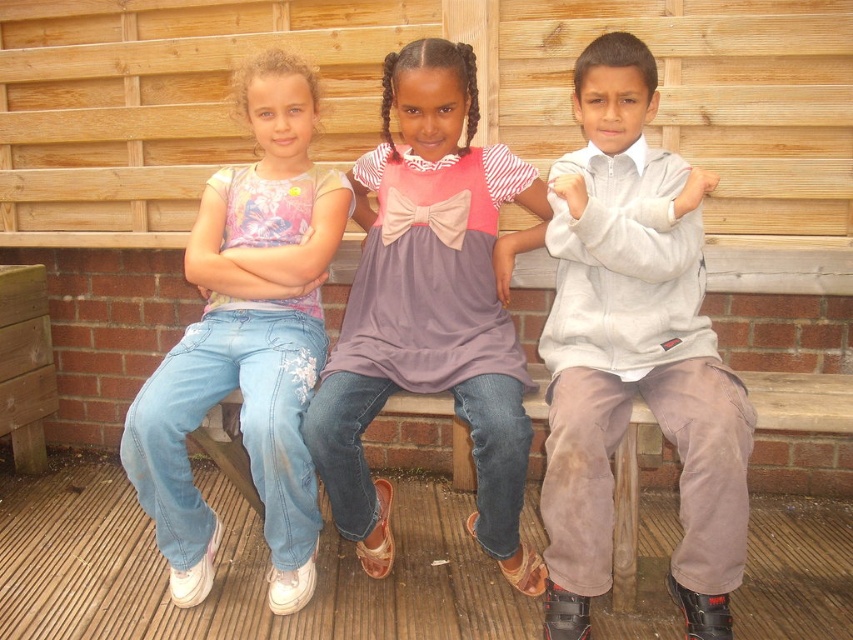
Can you confirm if light gray fleece jacket at center is wider than pink satin dress at center?

Incorrect, light gray fleece jacket at center's width does not surpass pink satin dress at center's.

Which is in front, point (631, 147) or point (483, 476)?

Point (483, 476) is in front.

Does point (606, 216) come in front of point (461, 84)?

Yes, point (606, 216) is closer to viewer.

This screenshot has width=853, height=640. Identify the location of light gray fleece jacket at center. (634, 353).

Who is positioned more to the left, pink satin dress at center or light blue denim jeans at left?

Positioned to the left is light blue denim jeans at left.

Does pink satin dress at center appear on the right side of light blue denim jeans at left?

Yes, pink satin dress at center is to the right of light blue denim jeans at left.

Locate an element on the screen. Image resolution: width=853 pixels, height=640 pixels. pink satin dress at center is located at coordinates (431, 307).

Is light gray fleece jacket at center smaller than light blue denim jeans at left?

Correct, light gray fleece jacket at center occupies less space than light blue denim jeans at left.

Does light gray fleece jacket at center have a lesser width compared to light blue denim jeans at left?

Yes.

Identify the location of light gray fleece jacket at center. This screenshot has width=853, height=640. (634, 353).